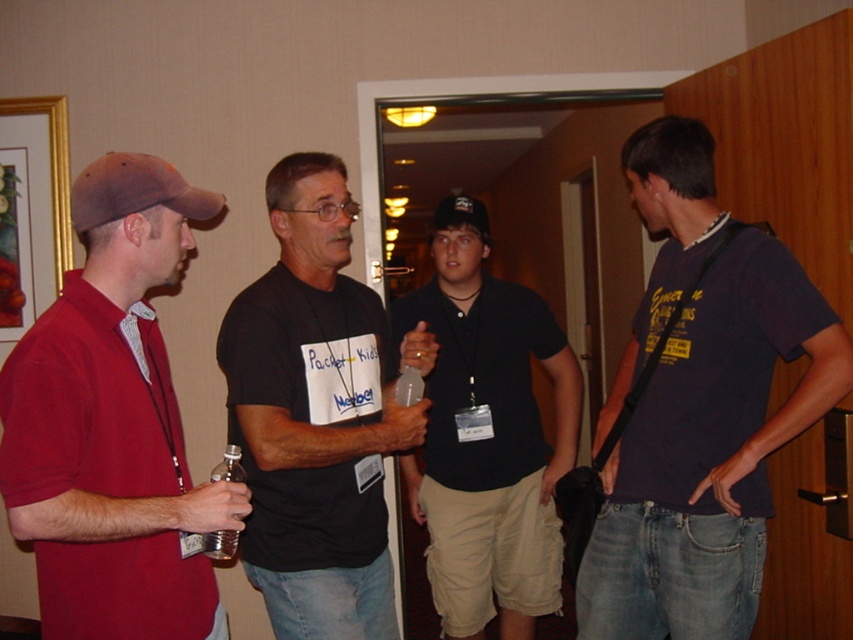
Question: Can you confirm if black matte t-shirt at center is positioned to the left of translucent plastic bottle at center?

Choices:
 (A) no
 (B) yes

Answer: (A)

Question: Which of the following is the farthest from the observer?

Choices:
 (A) (277, 540)
 (B) (207, 198)
 (C) (523, 451)

Answer: (C)

Question: Is matte red polo shirt at left thinner than translucent plastic bottle at center?

Choices:
 (A) yes
 (B) no

Answer: (B)

Question: Does dark blue shirt at center have a smaller size compared to translucent plastic bottle at center?

Choices:
 (A) no
 (B) yes

Answer: (A)

Question: Which is nearer to the dark blue t-shirt at center?

Choices:
 (A) black matte t-shirt at center
 (B) translucent plastic bottle at center

Answer: (A)

Question: Which object is farther from the camera taking this photo?

Choices:
 (A) black matte t-shirt at center
 (B) dark blue shirt at center
 (C) matte red polo shirt at left

Answer: (B)